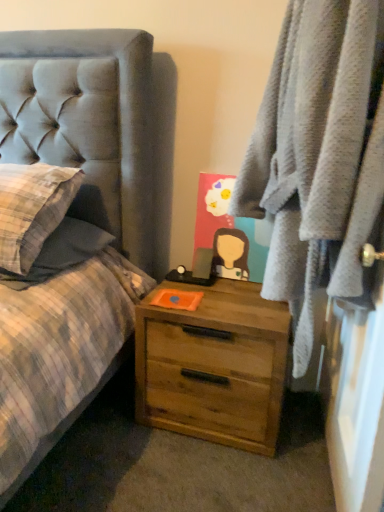
Question: From a real-world perspective, is wooden chest of drawers at lower right positioned above or below soft gray robe at right?

Choices:
 (A) above
 (B) below

Answer: (B)

Question: Considering their positions, is wooden chest of drawers at lower right located in front of or behind soft gray robe at right?

Choices:
 (A) behind
 (B) front

Answer: (A)

Question: Is point (276, 338) closer or farther from the camera than point (251, 212)?

Choices:
 (A) closer
 (B) farther

Answer: (A)

Question: Is soft gray robe at right inside or outside of wooden chest of drawers at lower right?

Choices:
 (A) inside
 (B) outside

Answer: (B)

Question: In terms of height, does soft gray robe at right look taller or shorter compared to wooden chest of drawers at lower right?

Choices:
 (A) short
 (B) tall

Answer: (B)

Question: From a real-world perspective, is soft gray robe at right positioned above or below wooden chest of drawers at lower right?

Choices:
 (A) below
 (B) above

Answer: (B)

Question: Considering the positions of point (309, 38) and point (198, 331), is point (309, 38) closer or farther from the camera than point (198, 331)?

Choices:
 (A) closer
 (B) farther

Answer: (A)